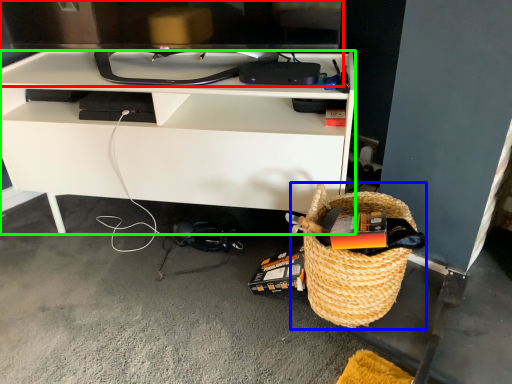
Question: Estimate the real-world distances between objects in this image. Which object is farther from television (highlighted by a red box), picnic basket (highlighted by a blue box) or desk (highlighted by a green box)?

Choices:
 (A) picnic basket
 (B) desk

Answer: (A)